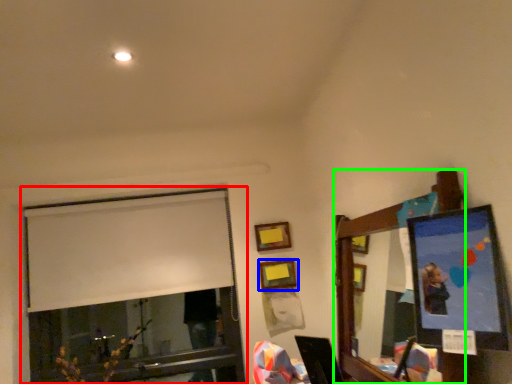
Question: Which object is positioned farthest from window (highlighted by a red box)? Select from picture frame (highlighted by a blue box) and mirror (highlighted by a green box).

Choices:
 (A) picture frame
 (B) mirror

Answer: (B)